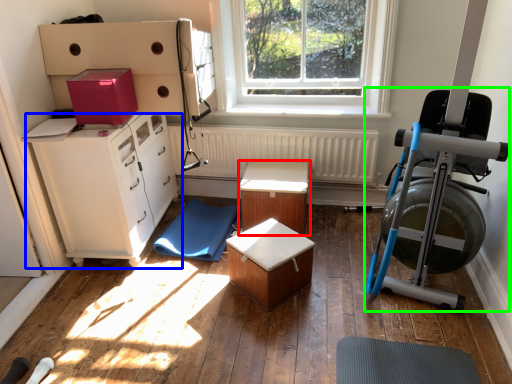
Question: Based on their relative distances, which object is farther from table (highlighted by a red box)? Choose from chest of drawers (highlighted by a blue box) and baby carriage (highlighted by a green box).

Choices:
 (A) chest of drawers
 (B) baby carriage

Answer: (B)